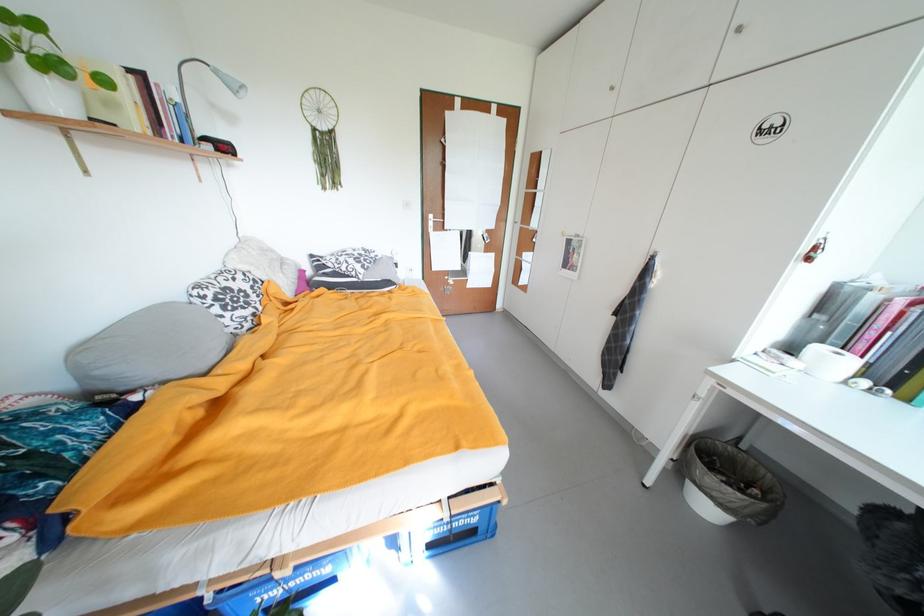
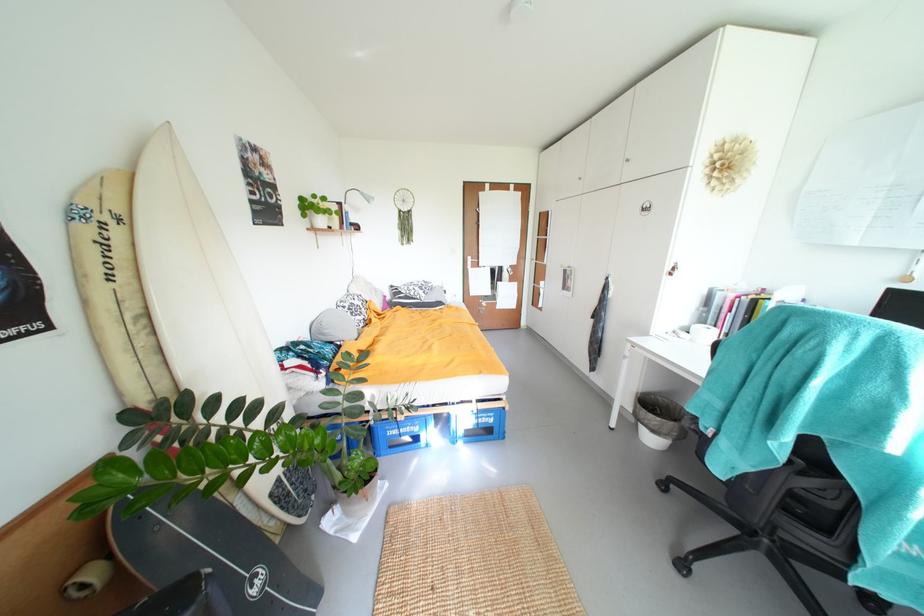
In the second image, find the point that corresponds to pixel 225 74 in the first image.

(370, 196)